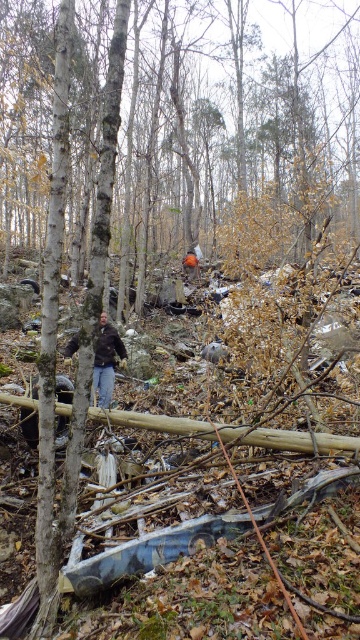
Question: Does dark brown leather jacket at center have a greater width compared to orange fabric person at center?

Choices:
 (A) no
 (B) yes

Answer: (A)

Question: Where is dark brown leather jacket at center located in relation to orange fabric person at center in the image?

Choices:
 (A) below
 (B) above

Answer: (A)

Question: Can you confirm if dark brown leather jacket at center is thinner than orange fabric person at center?

Choices:
 (A) yes
 (B) no

Answer: (A)

Question: Which point appears farthest from the camera in this image?

Choices:
 (A) (114, 353)
 (B) (198, 266)

Answer: (B)

Question: Among these objects, which one is farthest from the camera?

Choices:
 (A) orange fabric person at center
 (B) dark brown leather jacket at center

Answer: (A)